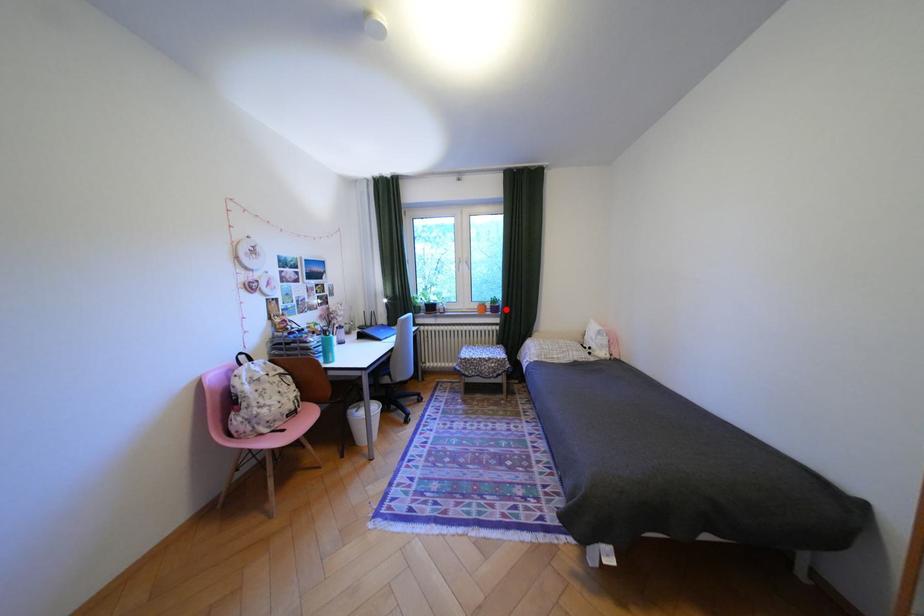
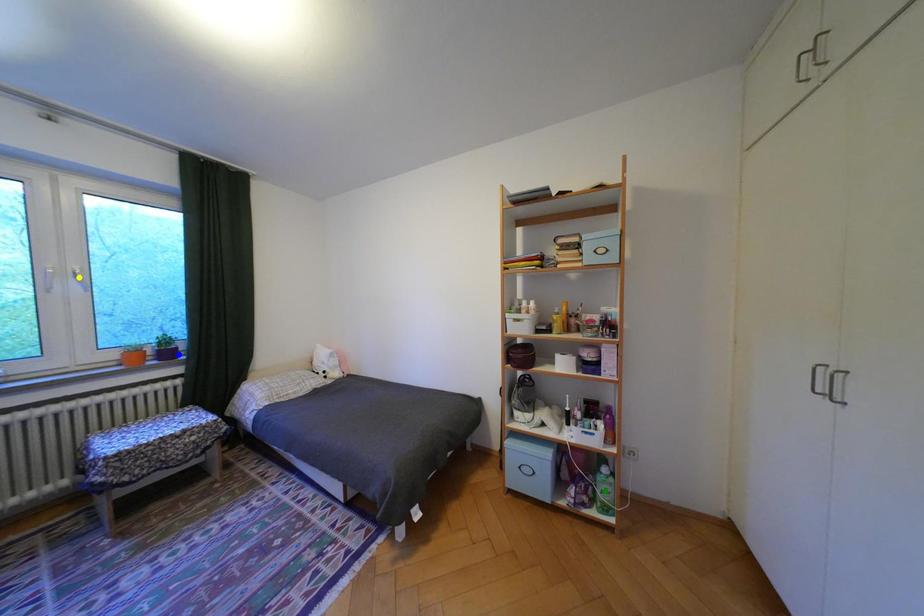
Question: I am providing you with two images of the same scene from different viewpoints. A red point is marked on the first image. You are given multiple points on the second image. Which point in image 2 represents the same 3d spot as the red point in image 1?

Choices:
 (A) yellow point
 (B) green point
 (C) blue point

Answer: (C)